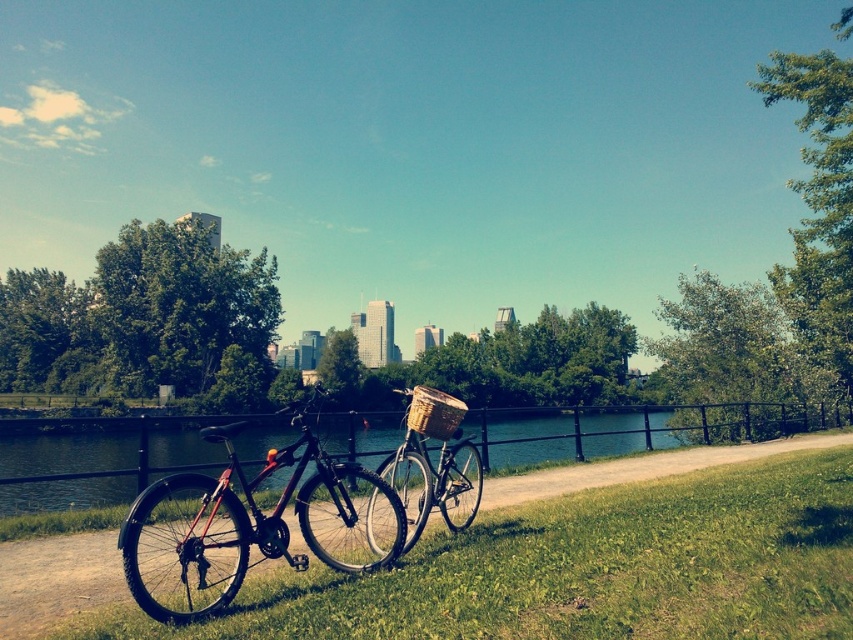
Is shiny black mountain bike at center closer to the viewer compared to matte brown basket at center?

Yes, it is in front of matte brown basket at center.

Can you confirm if shiny black mountain bike at center is smaller than matte brown basket at center?

No, shiny black mountain bike at center is not smaller than matte brown basket at center.

Between point (358, 564) and point (465, 461), which one is positioned in front?

Point (358, 564) is in front.

At what (x,y) coordinates should I click in order to perform the action: click on shiny black mountain bike at center. Please return your answer as a coordinate pair (x, y). Looking at the image, I should click on (241, 522).

Is point (509, 442) positioned before point (426, 472)?

No, it is behind (426, 472).

The height and width of the screenshot is (640, 853). Describe the element at coordinates (67, 452) in the screenshot. I see `green water at lower left` at that location.

I want to click on green water at lower left, so click(x=67, y=452).

Between green grass at lower left and shiny black mountain bike at center, which one has less height?

green grass at lower left is shorter.

From the picture: Is green grass at lower left shorter than shiny black mountain bike at center?

Yes, green grass at lower left is shorter than shiny black mountain bike at center.

Is point (605, 531) closer to camera compared to point (192, 554)?

No, it is behind (192, 554).

Where is `green grass at lower left`? green grass at lower left is located at coordinates (583, 570).